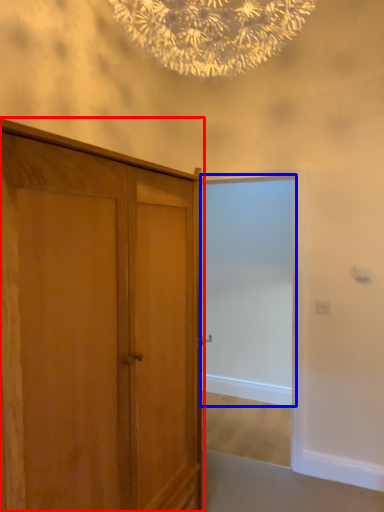
Question: Which object is further to the camera taking this photo, cupboard (highlighted by a red box) or screen door (highlighted by a blue box)?

Choices:
 (A) cupboard
 (B) screen door

Answer: (B)